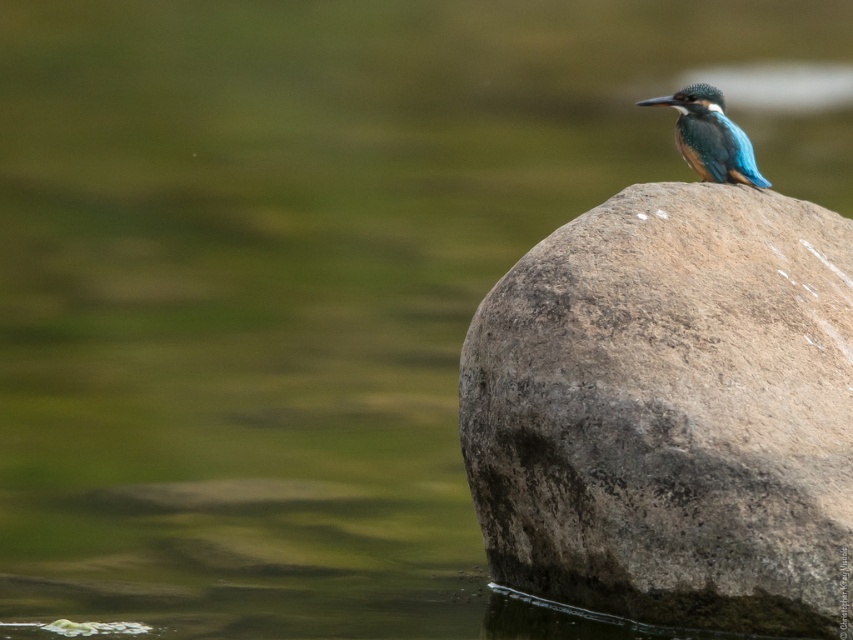
Does rough stone boulder at center have a greater height compared to blue glossy kingfisher at center?

Yes.

Is rough stone boulder at center further to the viewer compared to blue glossy kingfisher at center?

No, it is in front of blue glossy kingfisher at center.

The width and height of the screenshot is (853, 640). Find the location of `rough stone boulder at center`. rough stone boulder at center is located at coordinates (671, 412).

Locate an element on the screen. The image size is (853, 640). rough stone boulder at center is located at coordinates (x=671, y=412).